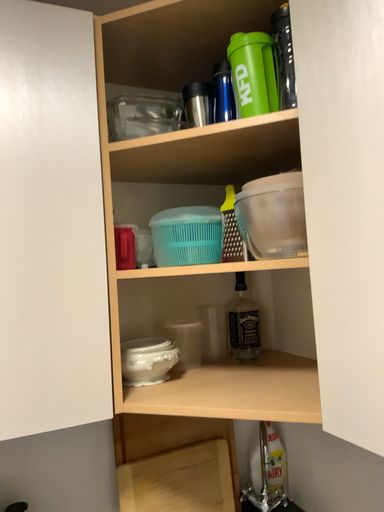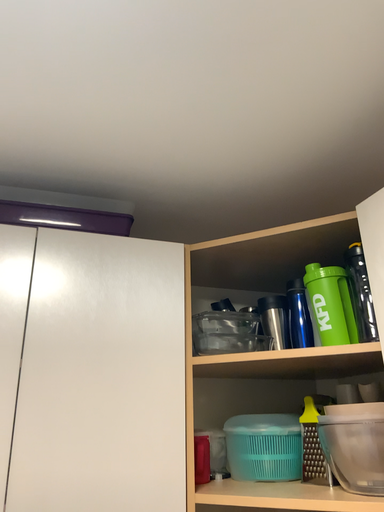
Question: How did the camera likely rotate when shooting the video?

Choices:
 (A) rotated downward
 (B) rotated upward

Answer: (B)